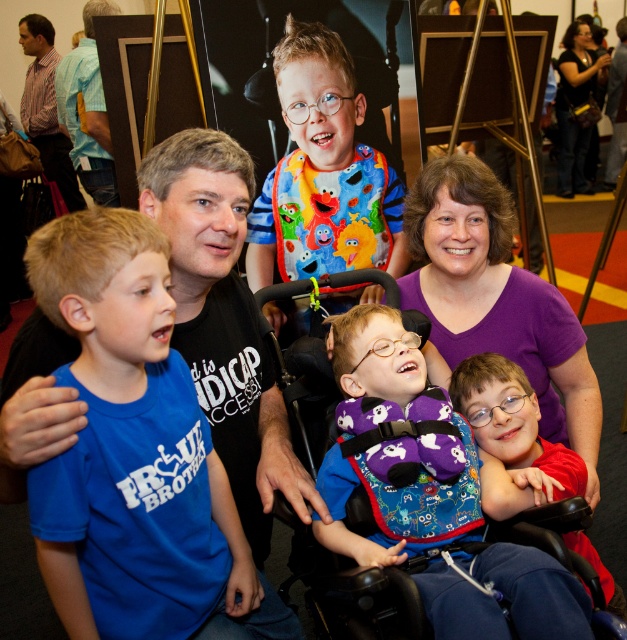
What is located at the coordinates point (137,449)?

The blue cotton shirt at left is located at point (137,449).

You are standing in the convention center and want to take a photo of the two points mentioned. Which point, point (171, 422) or point (51, 120), would appear larger in your camera view?

Point (171, 422) is closer to the viewer than point (51, 120), so it would appear larger in the camera view.

From the picture: You are a photographer at the event and need to capture a photo of both the blue cotton shirt at left and the striped cotton shirt at upper left. Which shirt should you focus on first to ensure both are in frame?

You should focus on the blue cotton shirt at left first since it is closer to the viewer, allowing the striped cotton shirt at upper left to remain in the frame as well.